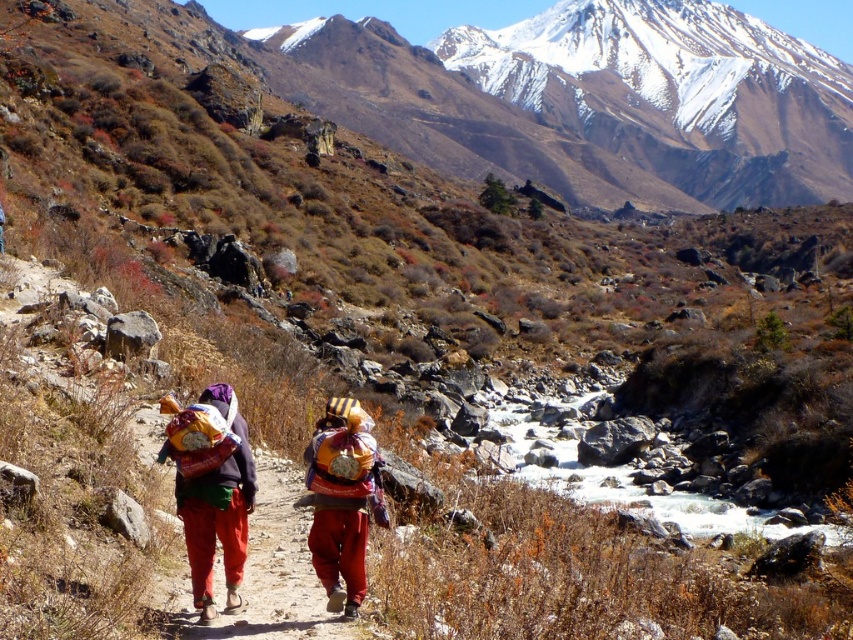
In the scene shown: Between snowy rock mountain at upper center and matte red pants at center, which one appears on the right side from the viewer's perspective?

snowy rock mountain at upper center is more to the right.

Does snowy rock mountain at upper center appear on the left side of matte red pants at center?

In fact, snowy rock mountain at upper center is to the right of matte red pants at center.

Between point (607, 104) and point (234, 540), which one is positioned behind?

Positioned behind is point (607, 104).

Locate an element on the screen. The height and width of the screenshot is (640, 853). snowy rock mountain at upper center is located at coordinates (614, 93).

Is snowy rock mountain at upper center to the left of reddish-brown fabric bag at center from the viewer's perspective?

Incorrect, snowy rock mountain at upper center is not on the left side of reddish-brown fabric bag at center.

Can you confirm if snowy rock mountain at upper center is positioned above reddish-brown fabric bag at center?

Indeed, snowy rock mountain at upper center is positioned over reddish-brown fabric bag at center.

Between point (578, 8) and point (352, 496), which one is positioned behind?

The point (578, 8) is more distant.

Find the location of a particular element. Image resolution: width=853 pixels, height=640 pixels. snowy rock mountain at upper center is located at coordinates [x=614, y=93].

Who is lower down, matte red pants at center or reddish-brown fabric bag at center?

matte red pants at center is lower down.

Based on the photo, which is more to the left, matte red pants at center or reddish-brown fabric bag at center?

Positioned to the left is matte red pants at center.

Between point (223, 420) and point (329, 524), which one is positioned behind?

The point (329, 524) is more distant.

The height and width of the screenshot is (640, 853). What are the coordinates of `matte red pants at center` in the screenshot? It's located at (212, 488).